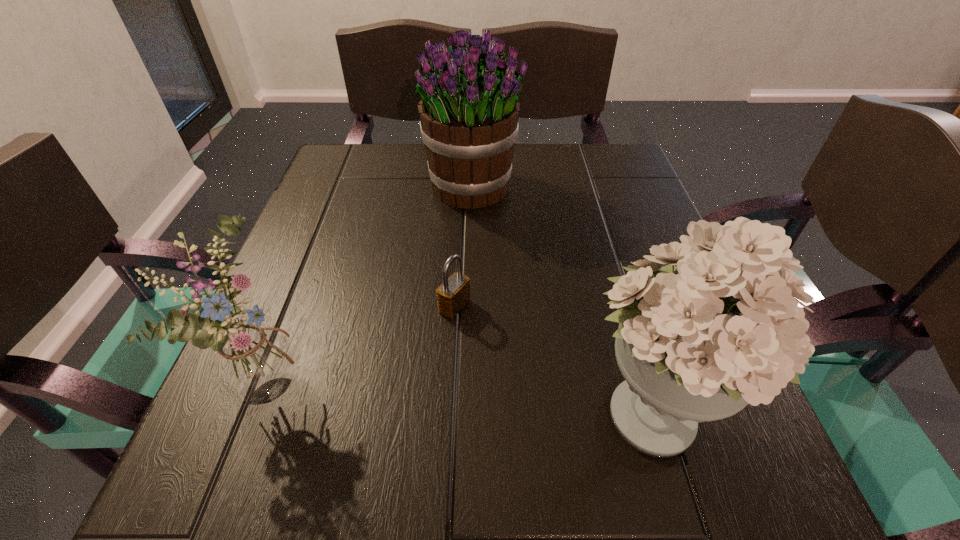
Where is `vacant space situated on the left of the shortest object`? The image size is (960, 540). vacant space situated on the left of the shortest object is located at coordinates (328, 307).

This screenshot has height=540, width=960. Identify the location of object located at the far edge. (469, 111).

Where is `object that is at the near edge`? object that is at the near edge is located at coordinates (727, 331).

Identify the location of object that is at the left edge. (254, 366).

Where is `object that is positioned at the right edge`? object that is positioned at the right edge is located at coordinates (727, 331).

Where is `object situated at the near right corner`? The image size is (960, 540). object situated at the near right corner is located at coordinates (727, 331).

Where is `blank area at the far edge`? Image resolution: width=960 pixels, height=540 pixels. blank area at the far edge is located at coordinates 398,163.

Find the location of `blank space at the near edge`. blank space at the near edge is located at coordinates (535, 467).

You are a GUI agent. You are given a task and a screenshot of the screen. Output one action in this format:
    pyautogui.click(x=<x>, y=<y>)
    Task: Click on the vacant space at the left edge of the desktop
    Image resolution: width=960 pixels, height=540 pixels.
    Given the screenshot: What is the action you would take?
    pyautogui.click(x=323, y=310)

Find the location of a particular element. The height and width of the screenshot is (540, 960). vacant space at the far left corner of the desktop is located at coordinates (335, 193).